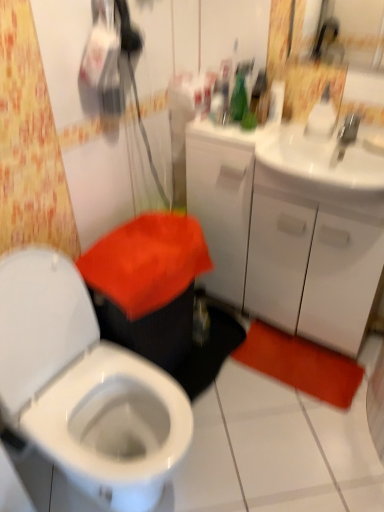
Locate an element on the screen. The width and height of the screenshot is (384, 512). white glossy cabinet at center is located at coordinates (290, 229).

Describe the element at coordinates (290, 229) in the screenshot. This screenshot has width=384, height=512. I see `white glossy cabinet at center` at that location.

Identify the location of white glossy cabinet at center. (290, 229).